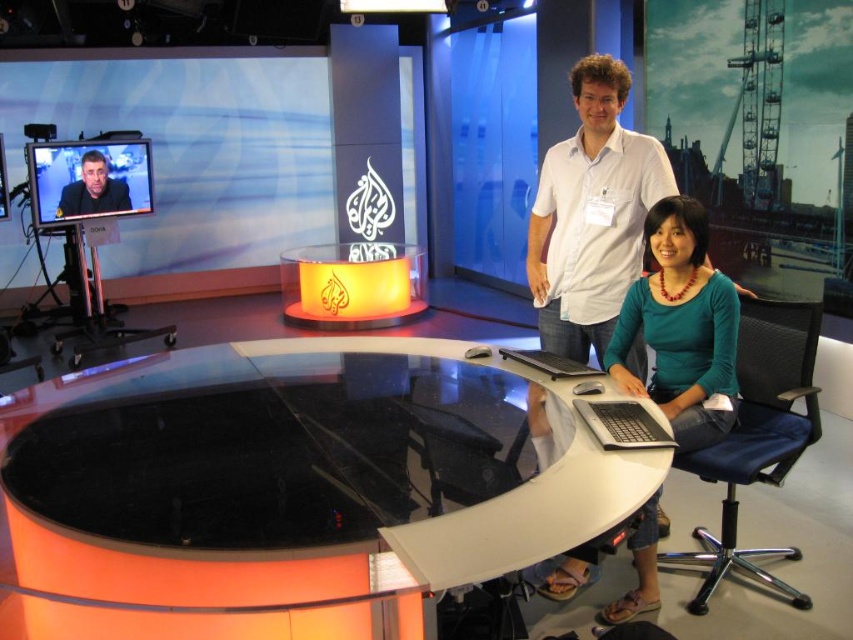
Question: Is black mesh swivel chair at lower right positioned in front of black plastic laptop at lower center?

Choices:
 (A) no
 (B) yes

Answer: (B)

Question: Which point is closer to the camera?

Choices:
 (A) (285, 524)
 (B) (764, 572)
 (C) (503, 349)

Answer: (A)

Question: Is matte black suit at upper left further to the viewer compared to black plastic laptop at lower center?

Choices:
 (A) no
 (B) yes

Answer: (B)

Question: Among these objects, which one is farthest from the camera?

Choices:
 (A) silver metallic laptop at lower center
 (B) transparent glass table at center
 (C) matte black suit at upper left

Answer: (C)

Question: Considering the relative positions of silver metallic laptop at lower center and black plastic laptop at lower center in the image provided, where is silver metallic laptop at lower center located with respect to black plastic laptop at lower center?

Choices:
 (A) right
 (B) left

Answer: (A)

Question: Which object is farther from the camera taking this photo?

Choices:
 (A) matte black suit at upper left
 (B) teal jersey at center

Answer: (A)